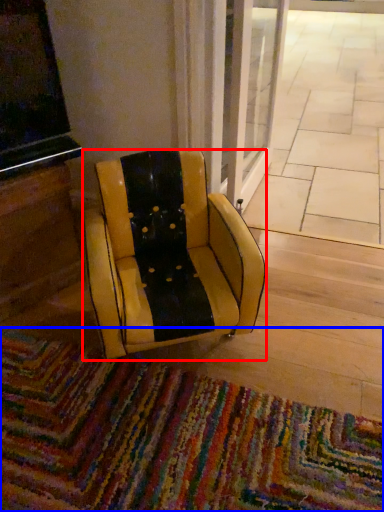
Question: Among these objects, which one is nearest to the camera, chair (highlighted by a red box) or mat (highlighted by a blue box)?

Choices:
 (A) chair
 (B) mat

Answer: (B)